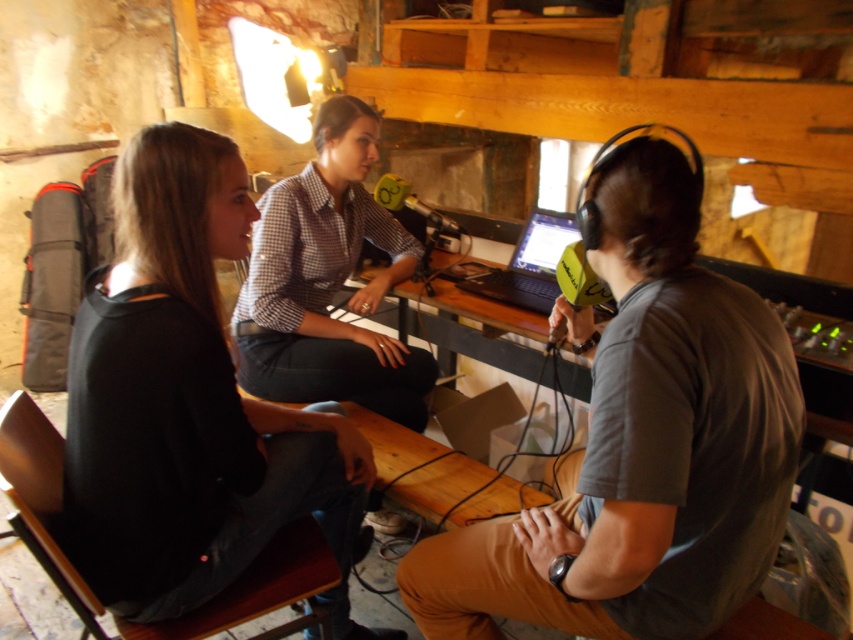
Question: Estimate the real-world distances between objects in this image. Which object is farther from the black matte laptop at center?

Choices:
 (A) black matte shirt at left
 (B) gray cotton shirt at right

Answer: (B)

Question: In this image, where is black matte shirt at left located relative to black matte laptop at center?

Choices:
 (A) right
 (B) left

Answer: (B)

Question: Which object is positioned closest to the black matte laptop at center?

Choices:
 (A) black matte shirt at left
 (B) gray cotton shirt at right

Answer: (A)

Question: Which of the following is the closest to the observer?

Choices:
 (A) black matte shirt at left
 (B) gray cotton shirt at right
 (C) black matte laptop at center

Answer: (B)

Question: Is gray cotton shirt at right smaller than black matte shirt at left?

Choices:
 (A) yes
 (B) no

Answer: (A)

Question: Is black matte shirt at left smaller than black matte laptop at center?

Choices:
 (A) no
 (B) yes

Answer: (A)